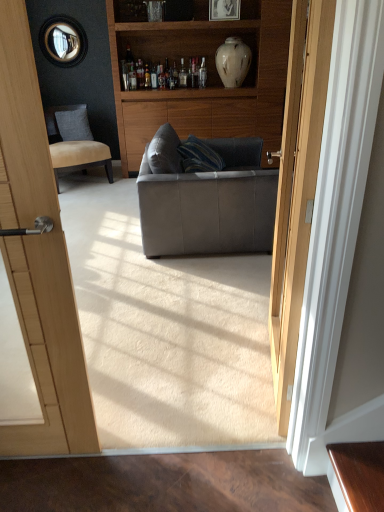
Question: From a real-world perspective, is leather couch at center over white glossy vase at upper center?

Choices:
 (A) no
 (B) yes

Answer: (A)

Question: Does leather couch at center appear on the left side of white glossy vase at upper center?

Choices:
 (A) yes
 (B) no

Answer: (A)

Question: Is leather couch at center turned away from white glossy vase at upper center?

Choices:
 (A) no
 (B) yes

Answer: (A)

Question: Would you say leather couch at center is outside white glossy vase at upper center?

Choices:
 (A) no
 (B) yes

Answer: (B)

Question: Can you confirm if leather couch at center is shorter than white glossy vase at upper center?

Choices:
 (A) yes
 (B) no

Answer: (B)

Question: Considering the relative sizes of leather couch at center and white glossy vase at upper center in the image provided, is leather couch at center wider than white glossy vase at upper center?

Choices:
 (A) yes
 (B) no

Answer: (A)

Question: Can you confirm if matte black picture frame at upper center is taller than white glossy vase at upper center?

Choices:
 (A) yes
 (B) no

Answer: (B)

Question: From the image's perspective, is matte black picture frame at upper center under white glossy vase at upper center?

Choices:
 (A) no
 (B) yes

Answer: (A)

Question: Is matte black picture frame at upper center looking in the opposite direction of white glossy vase at upper center?

Choices:
 (A) no
 (B) yes

Answer: (A)

Question: From a real-world perspective, is matte black picture frame at upper center physically above white glossy vase at upper center?

Choices:
 (A) yes
 (B) no

Answer: (A)

Question: From a real-world perspective, does matte black picture frame at upper center sit lower than white glossy vase at upper center?

Choices:
 (A) yes
 (B) no

Answer: (B)

Question: Can you confirm if matte black picture frame at upper center is positioned to the left of white glossy vase at upper center?

Choices:
 (A) yes
 (B) no

Answer: (A)

Question: Is white glossy vase at upper center next to suede tan chair at left and touching it?

Choices:
 (A) yes
 (B) no

Answer: (B)